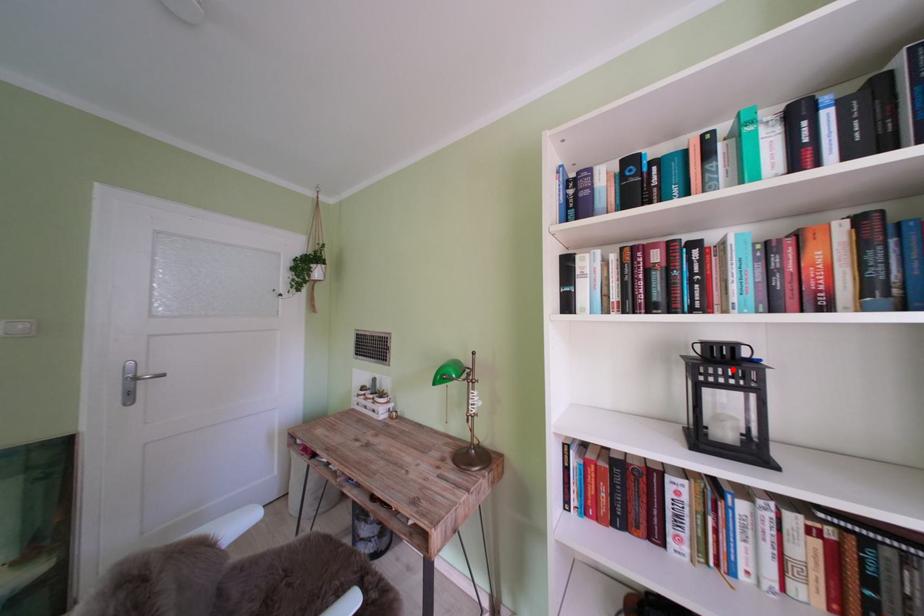
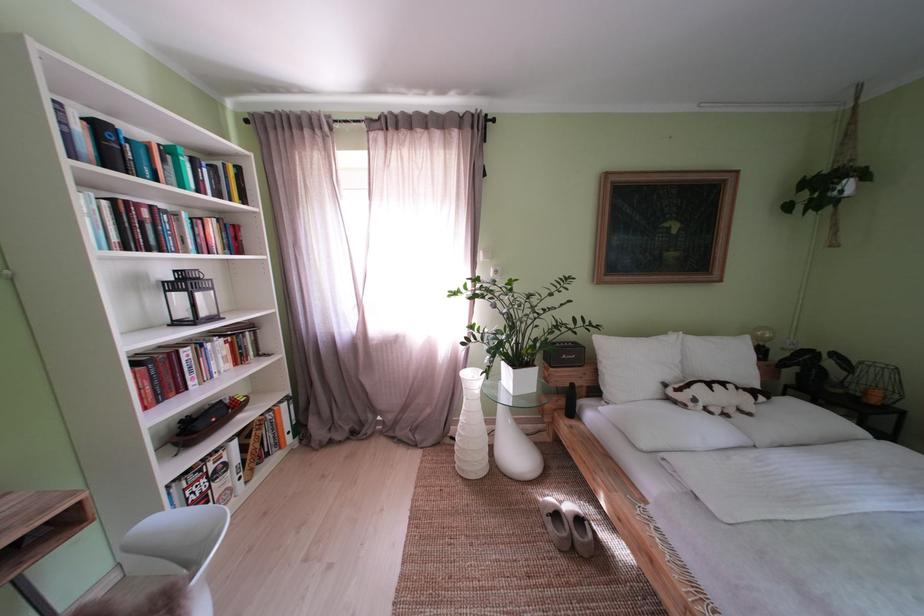
Question: I am providing you with two images of the same scene from different viewpoints. A red point is marked on the first image. Can you still see the location of the red point in image 2?

Choices:
 (A) Yes
 (B) No

Answer: (A)